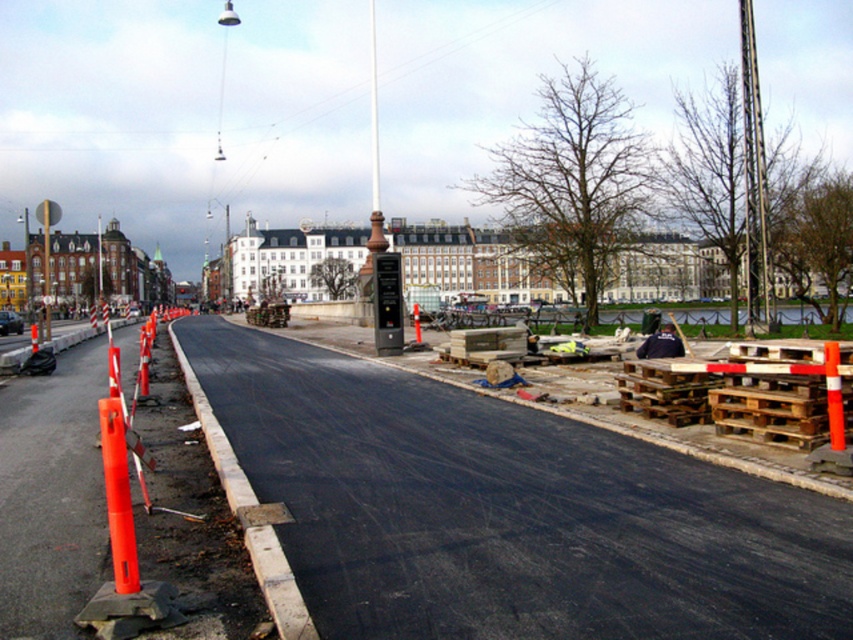
You are a delivery person who needs to place a package on the dark blue fabric at center. According to the image, where exactly should you place the package?

The dark blue fabric at center is located at coordinates point (660, 342), so place the package there.